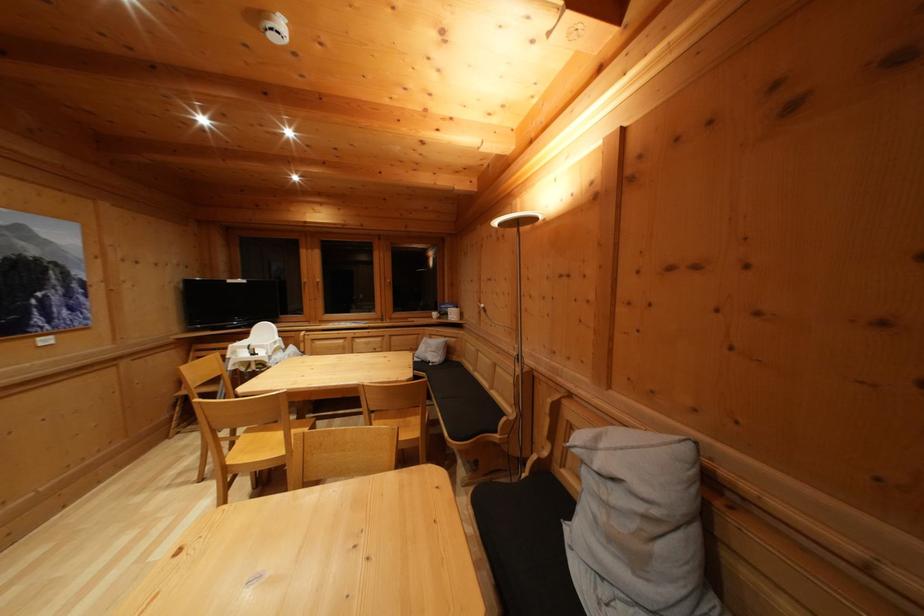
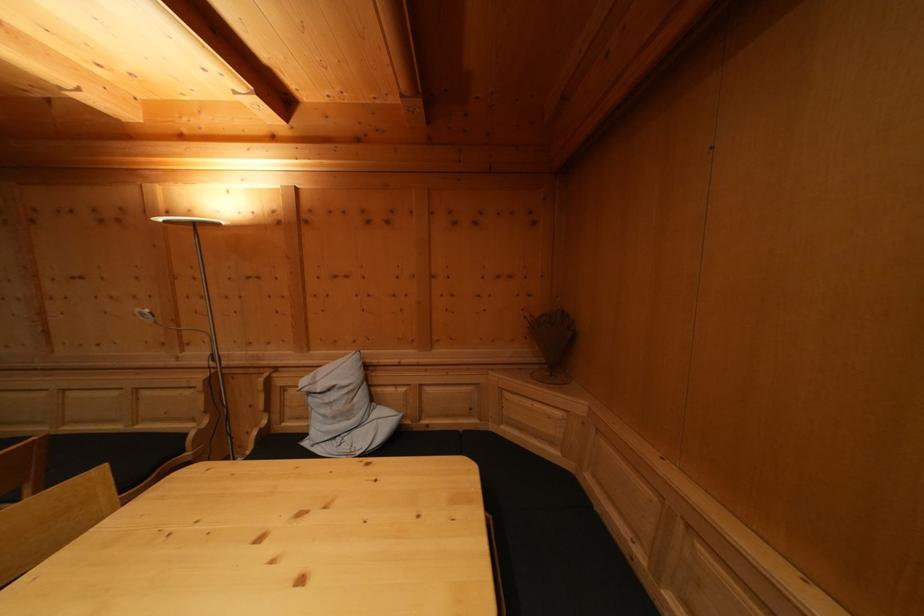
Question: The images are taken continuously from a first-person perspective. In which direction is your viewpoint rotating?

Choices:
 (A) Left
 (B) Right
 (C) Up
 (D) Down

Answer: (B)